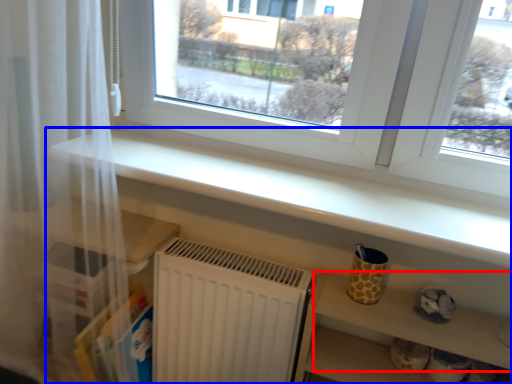
Question: Which object appears farthest to the camera in this image, shelf (highlighted by a red box) or shelf (highlighted by a blue box)?

Choices:
 (A) shelf
 (B) shelf

Answer: (A)